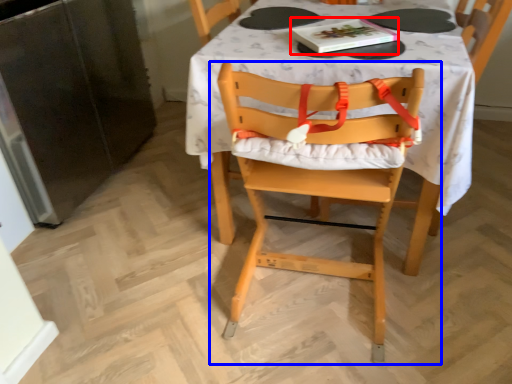
Question: Which point is closer to the camera, book (highlighted by a red box) or chair (highlighted by a blue box)?

Choices:
 (A) book
 (B) chair

Answer: (B)